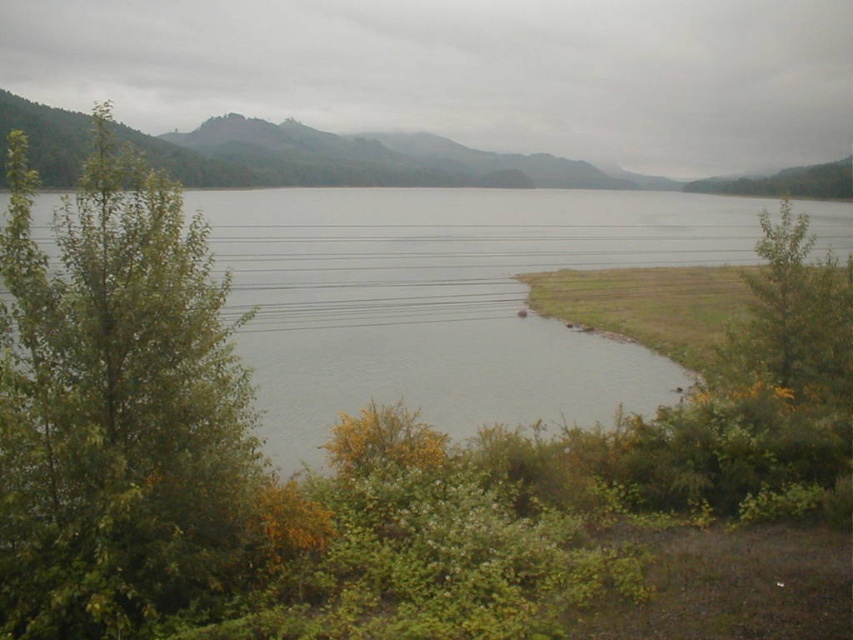
Looking at this image, you are standing at the edge of the lake and want to take a photo of both the green leafy tree at left and the clear water at center. Which object should you focus on first if you want to capture both in the same frame without moving your camera?

The green leafy tree at left has a lesser height compared to clear water at center, so you should focus on the clear water at center first to ensure both are in the frame.

You are standing at the edge of the lake and want to reach both the point marked as point (20, 522) and the point marked as point (413, 349). Which point should you go to first if you want to reach the closer one first?

You should go to point (20, 522) first because it is closer to the viewer than point (413, 349).

You are standing on the lakeshore and want to walk to the clear water at center. Which direction should you move relative to the green leafy tree at left?

To reach the clear water at center, you should move towards the right side away from the green leafy tree at left since the tree is located below the water in the image.